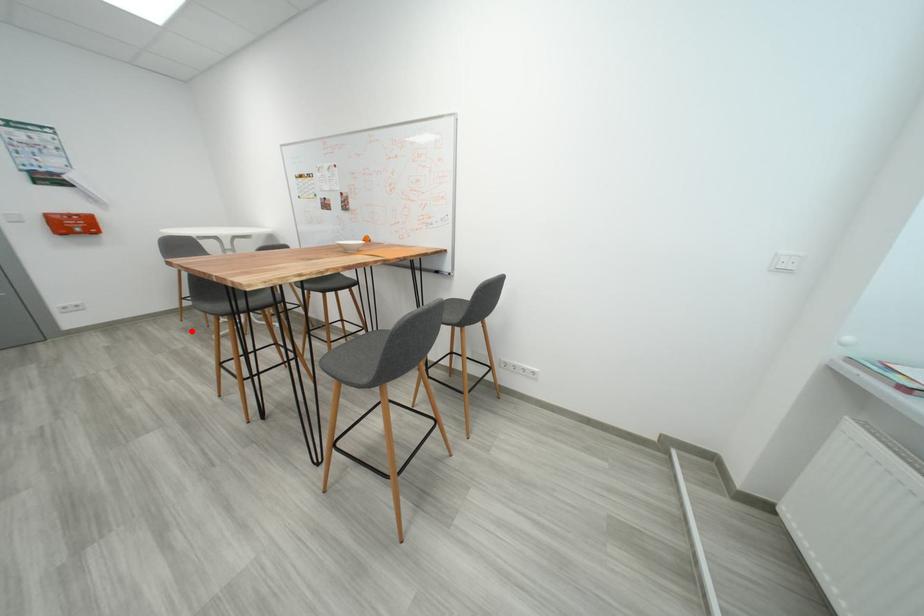
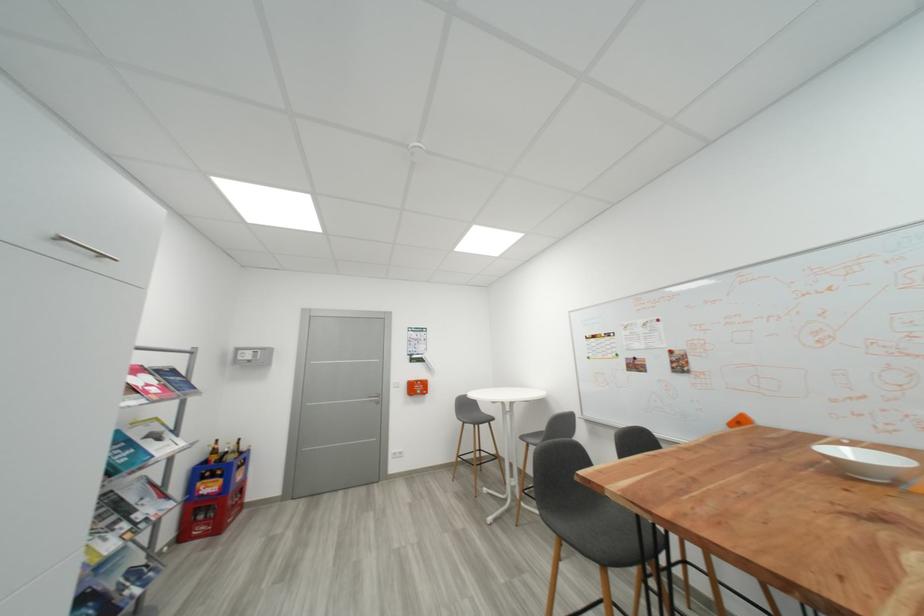
In the second image, find the point that corresponds to the highlighted location in the first image.

(465, 496)